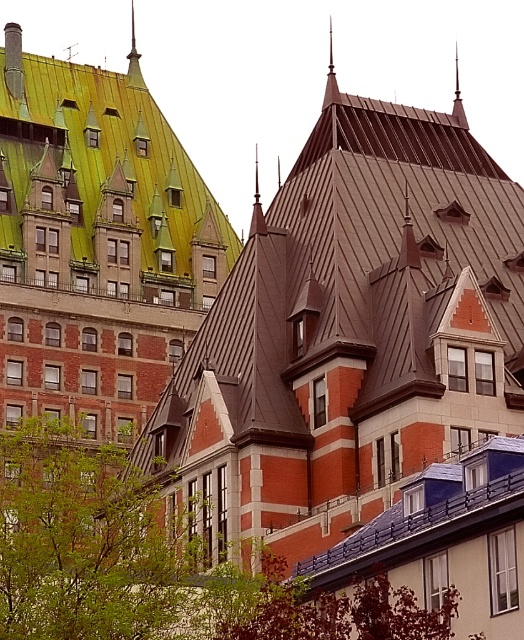
Question: Which object is positioned closest to the green leafy tree at lower left?

Choices:
 (A) green corrugated metal roof at upper left
 (B) green corrugated metal spire at upper center

Answer: (A)

Question: Which point is closer to the camera?

Choices:
 (A) (133, 76)
 (B) (230, 225)

Answer: (B)

Question: From the image, what is the correct spatial relationship of green corrugated metal roof at upper left in relation to green corrugated metal spire at upper center?

Choices:
 (A) above
 (B) below

Answer: (B)

Question: Can you confirm if green leafy tree at lower left is positioned below green corrugated metal roof at upper left?

Choices:
 (A) no
 (B) yes

Answer: (B)

Question: Which point appears farthest from the camera in this image?

Choices:
 (A) (111, 554)
 (B) (208, 189)

Answer: (B)

Question: Does green leafy tree at lower left lie in front of green corrugated metal roof at upper left?

Choices:
 (A) yes
 (B) no

Answer: (A)